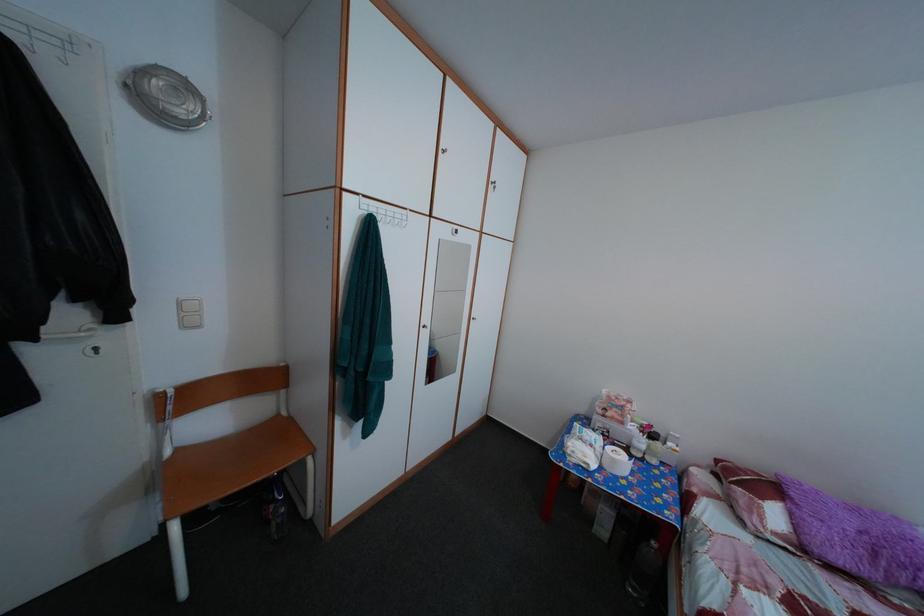
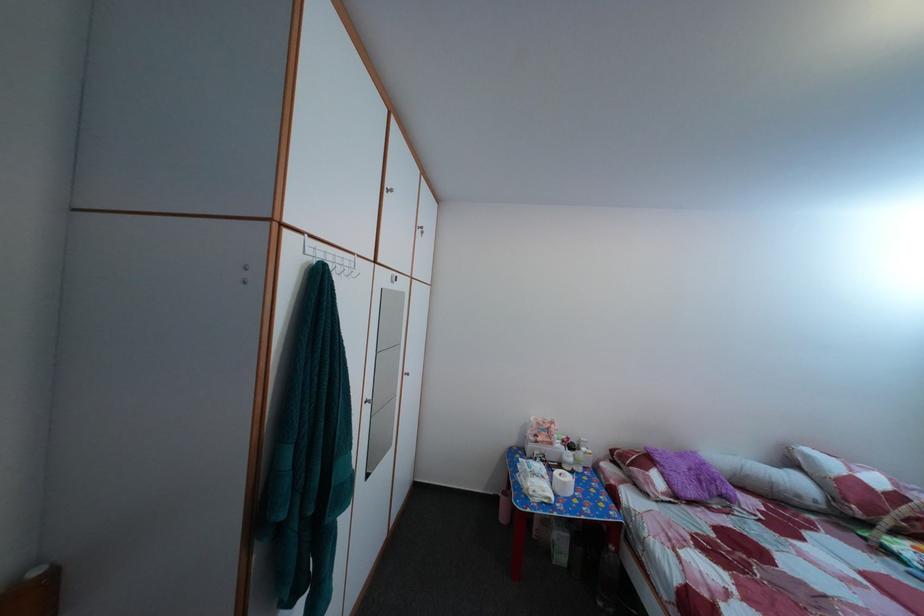
The point at (590, 464) is marked in the first image. Where is the corresponding point in the second image?

(551, 500)